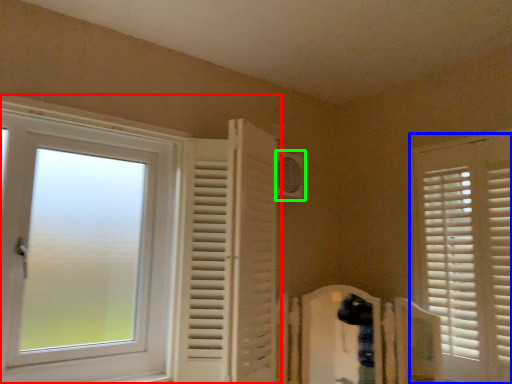
Question: Which object is the farthest from window (highlighted by a red box)? Choose among these: window (highlighted by a blue box) or air conditioning (highlighted by a green box).

Choices:
 (A) window
 (B) air conditioning

Answer: (A)